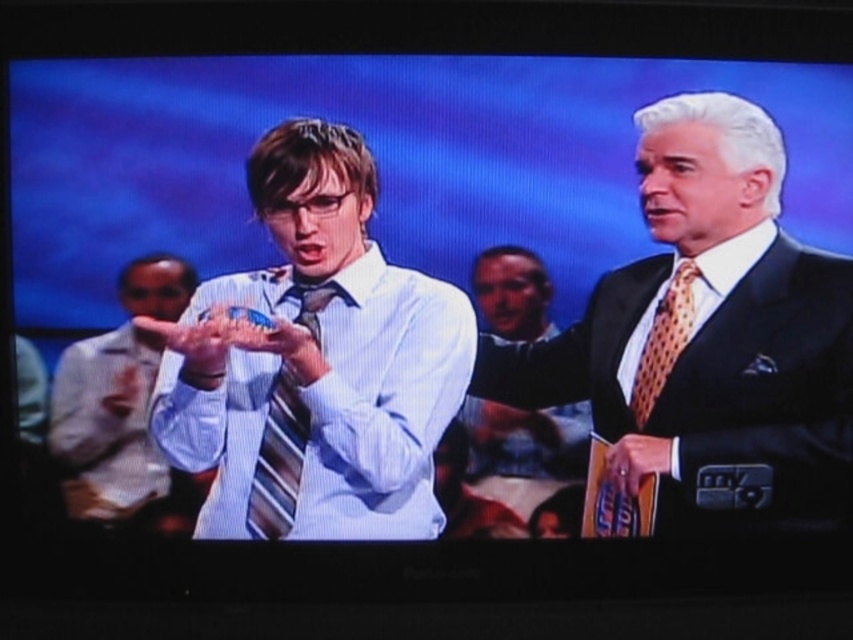
Question: Which point is farther to the camera?

Choices:
 (A) smooth black suit at right
 (B) striped fabric tie at center
 (C) orange dotted tie at right
 (D) striped tie at left

Answer: (C)

Question: Considering the real-world distances, which object is farthest from the white satin hand at center?

Choices:
 (A) smooth black suit at right
 (B) shiny black suit at right
 (C) striped fabric tie at center

Answer: (C)

Question: Considering the real-world distances, which object is farthest from the striped fabric tie at center?

Choices:
 (A) shiny black suit at right
 (B) white satin hand at center
 (C) striped tie at center

Answer: (A)

Question: Is shiny black suit at right to the left of striped tie at left from the viewer's perspective?

Choices:
 (A) no
 (B) yes

Answer: (A)

Question: Does smooth black suit at right lie in front of white satin hand at center?

Choices:
 (A) no
 (B) yes

Answer: (B)

Question: Does shiny black suit at right have a lesser width compared to orange dotted tie at right?

Choices:
 (A) no
 (B) yes

Answer: (A)